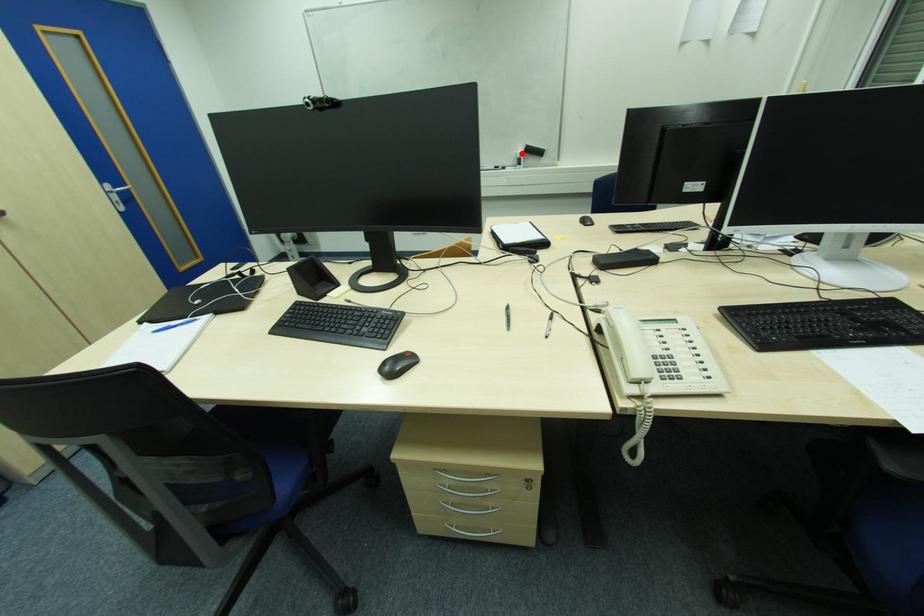
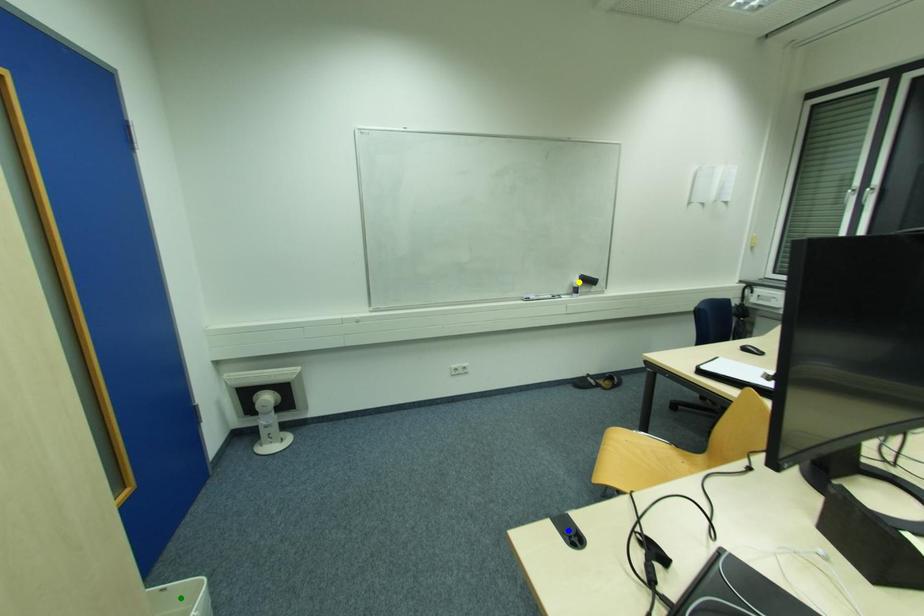
Question: I am providing you with two images of the same scene from different viewpoints. A red point is marked on the first image. You are given multiple points on the second image. Can you choose the point in image 2 that corresponds to the point in image 1?

Choices:
 (A) yellow point
 (B) blue point
 (C) green point

Answer: (A)